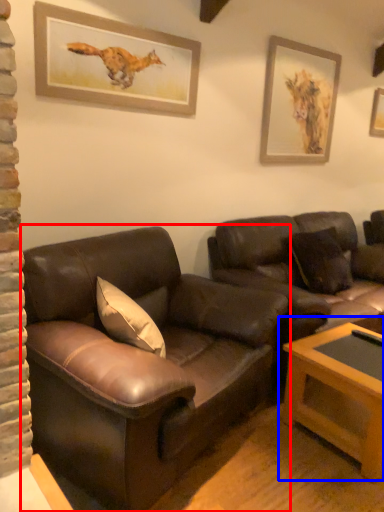
Question: Which of the following is the closest to the observer, studio couch (highlighted by a red box) or table (highlighted by a blue box)?

Choices:
 (A) studio couch
 (B) table

Answer: (A)